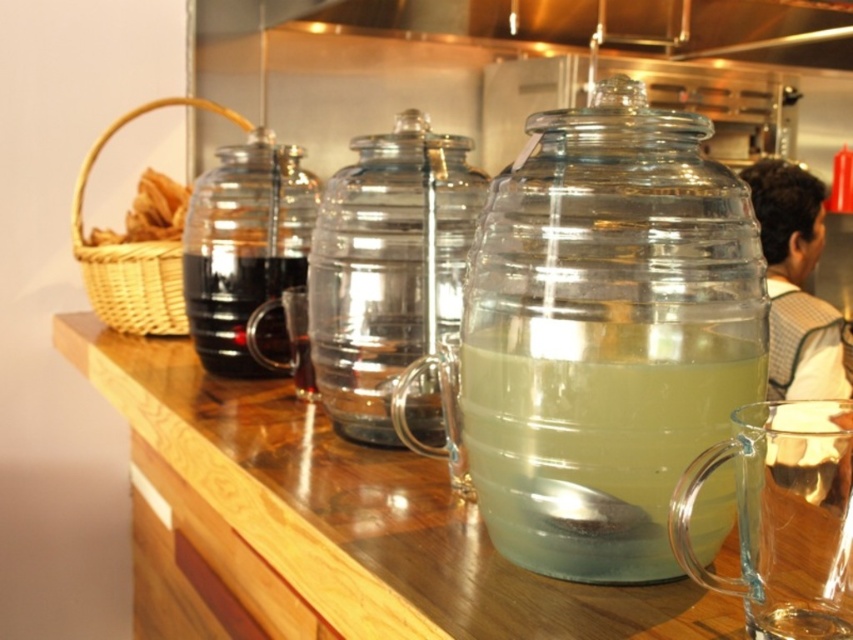
Is clear glass jar at center taller than clear glass jug at center?

No, clear glass jar at center is not taller than clear glass jug at center.

Between clear glass jar at center and clear glass jug at center, which one appears on the right side from the viewer's perspective?

clear glass jar at center is more to the right.

Is point (700, 316) farther from viewer compared to point (393, 376)?

No, it is in front of (393, 376).

The image size is (853, 640). Find the location of `clear glass jar at center`. clear glass jar at center is located at coordinates (605, 333).

Who is taller, clear glass jar at center or transparent glass carafe at center?

transparent glass carafe at center

Who is more forward, (692, 248) or (204, 173)?

Point (692, 248) is more forward.

Locate an element on the screen. This screenshot has height=640, width=853. clear glass jar at center is located at coordinates click(x=605, y=333).

Which is below, translucent glass jug at center or clear glass jug at center?

translucent glass jug at center

Can you confirm if translucent glass jug at center is wider than clear glass jug at center?

Incorrect, translucent glass jug at center's width does not surpass clear glass jug at center's.

Where is `translucent glass jug at center`? This screenshot has width=853, height=640. translucent glass jug at center is located at coordinates (595, 435).